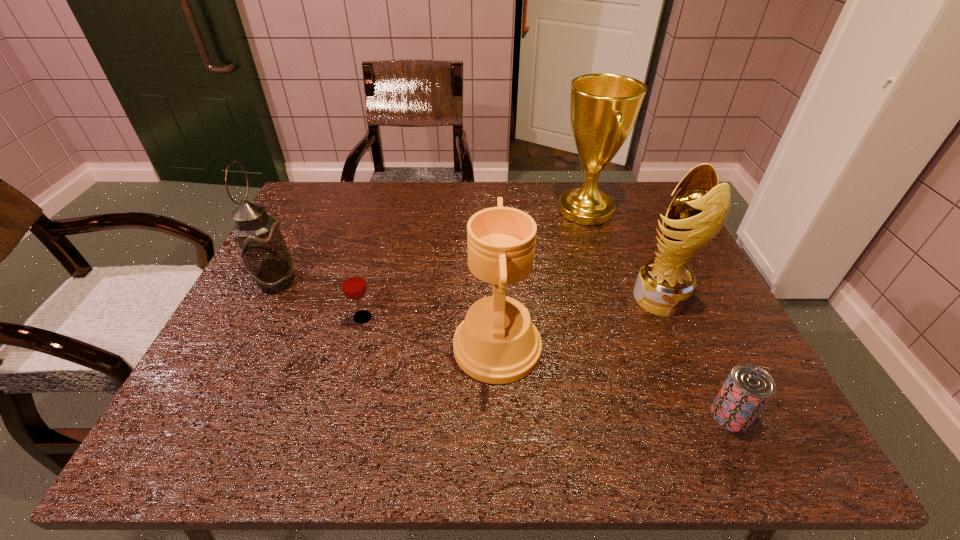
At what (x,y) coordinates should I click in order to perform the action: click on the farthest object. Please return your answer as a coordinate pair (x, y). The image size is (960, 540). Looking at the image, I should click on (604, 107).

Locate an element on the screen. The height and width of the screenshot is (540, 960). oil lamp is located at coordinates (264, 254).

The width and height of the screenshot is (960, 540). Find the location of `the leftmost award`. the leftmost award is located at coordinates (497, 343).

This screenshot has height=540, width=960. Identify the location of the fifth object from right to left. (354, 286).

Where is `the second shortest object`? Image resolution: width=960 pixels, height=540 pixels. the second shortest object is located at coordinates (354, 286).

Locate an element on the screen. the shortest object is located at coordinates (746, 391).

The image size is (960, 540). Find the location of `the nearest object`. the nearest object is located at coordinates (746, 391).

Find the location of a particular element. Image resolution: width=960 pixels, height=540 pixels. vacant space located 0.080m by the handles of the farthest object is located at coordinates (529, 210).

The width and height of the screenshot is (960, 540). Identify the location of free space located by the handles of the farthest object. (529, 210).

Image resolution: width=960 pixels, height=540 pixels. Find the location of `free space located by the handles of the farthest object`. free space located by the handles of the farthest object is located at coordinates (492, 210).